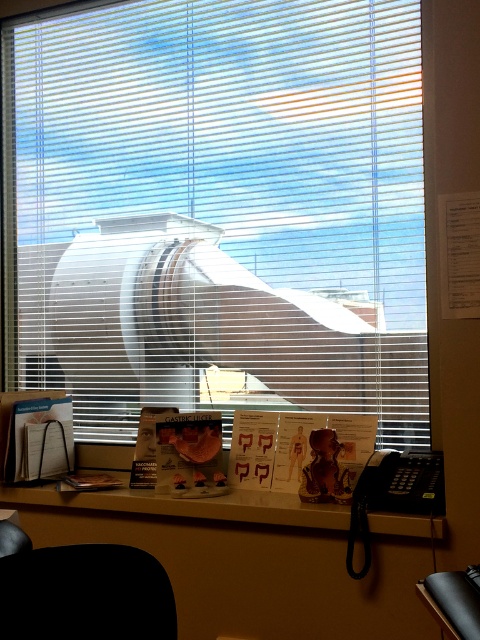
Between white plastic blinds at upper center and white glossy desk at lower center, which one appears on the right side from the viewer's perspective?

From the viewer's perspective, white glossy desk at lower center appears more on the right side.

Is white plastic blinds at upper center shorter than white glossy desk at lower center?

In fact, white plastic blinds at upper center may be taller than white glossy desk at lower center.

Where is `white plastic blinds at upper center`? The height and width of the screenshot is (640, 480). white plastic blinds at upper center is located at coordinates (216, 208).